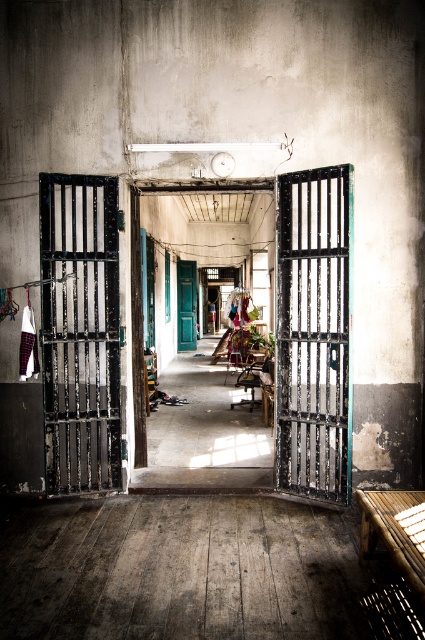
Question: Considering the real-world distances, which object is closest to the black metal bars at center?

Choices:
 (A) green wooden door at center
 (B) black metal gate at center

Answer: (B)

Question: Does black metal bars at center appear on the right side of black metal gate at center?

Choices:
 (A) no
 (B) yes

Answer: (A)

Question: Is black metal bars at center behind green wooden door at center?

Choices:
 (A) yes
 (B) no

Answer: (B)

Question: Which point is farther from the camera taking this photo?

Choices:
 (A) (45, 448)
 (B) (183, 284)
 (C) (328, 492)

Answer: (B)

Question: Which point is closer to the camera?

Choices:
 (A) green wooden door at center
 (B) black metal gate at center
 (C) black metal bars at center

Answer: (B)

Question: Can you confirm if black metal gate at center is positioned above green wooden door at center?

Choices:
 (A) yes
 (B) no

Answer: (B)